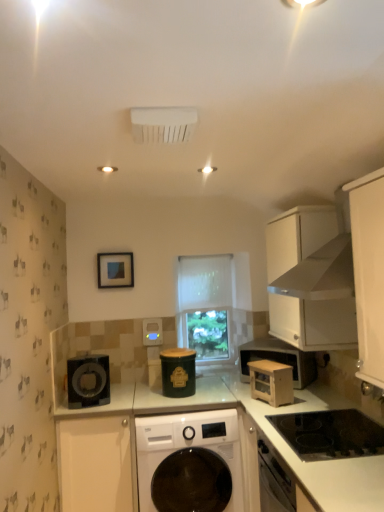
I want to click on vacant space in front of wooden microwave at center-right, so (275, 410).